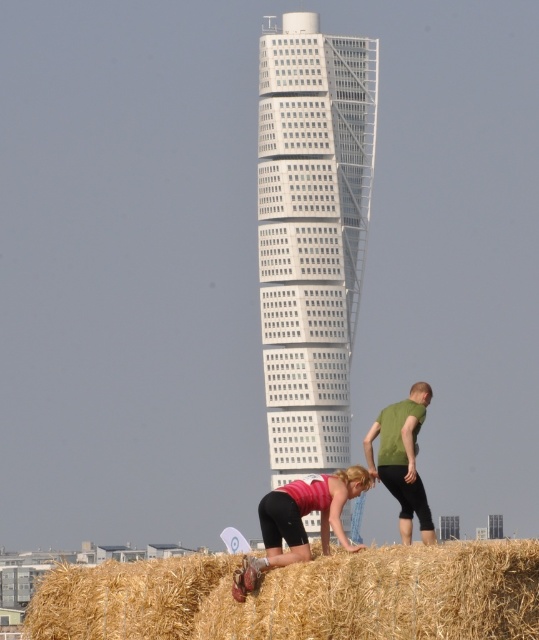
Does white glass building at center have a smaller size compared to white glass tower at center?

No.

Does white glass building at center appear under white glass tower at center?

Actually, white glass building at center is above white glass tower at center.

What do you see at coordinates (312, 230) in the screenshot? I see `white glass building at center` at bounding box center [312, 230].

Locate an element on the screen. The image size is (539, 640). white glass building at center is located at coordinates (312, 230).

Is white glass building at center bigger than matte pink shirt at lower center?

Yes, white glass building at center is bigger than matte pink shirt at lower center.

Which of these two, white glass building at center or matte pink shirt at lower center, stands shorter?

matte pink shirt at lower center is shorter.

Who is more distant from viewer, (322, 316) or (348, 468)?

The point (348, 468) is more distant.

Where is `white glass building at center`? Image resolution: width=539 pixels, height=640 pixels. white glass building at center is located at coordinates (312, 230).

Does white glass building at center have a smaller size compared to golden straw bale at lower center?

Yes.

Describe the element at coordinates (312, 230) in the screenshot. I see `white glass building at center` at that location.

The height and width of the screenshot is (640, 539). In order to click on white glass building at center in this screenshot , I will do `click(312, 230)`.